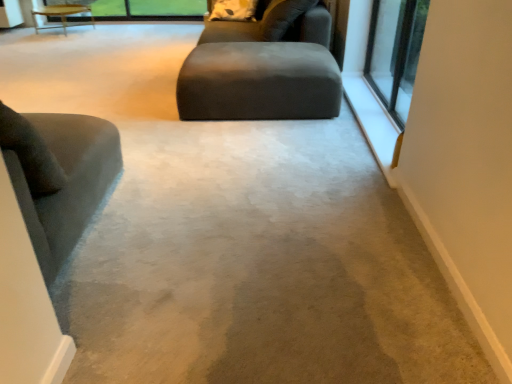
At what (x,y) coordinates should I click in order to perform the action: click on velvet gray chair at left. Please return your answer as a coordinate pair (x, y). Looking at the image, I should click on pos(58,176).

The width and height of the screenshot is (512, 384). Describe the element at coordinates (62, 15) in the screenshot. I see `wooden table at upper left` at that location.

Where is `wooden table at upper left`? This screenshot has width=512, height=384. wooden table at upper left is located at coordinates (62, 15).

What do you see at coordinates (261, 73) in the screenshot? Image resolution: width=512 pixels, height=384 pixels. I see `matte gray ottoman at center` at bounding box center [261, 73].

I want to click on white soft pillow at upper center, so click(x=233, y=10).

Which of these two, velvet gray chair at left or matte gray ottoman at center, is thinner?

velvet gray chair at left.

Between velvet gray chair at left and matte gray ottoman at center, which one is positioned in front?

velvet gray chair at left.

Considering the relative sizes of velvet gray chair at left and matte gray ottoman at center in the image provided, is velvet gray chair at left bigger than matte gray ottoman at center?

Indeed, velvet gray chair at left has a larger size compared to matte gray ottoman at center.

What's the angular difference between velvet gray chair at left and matte gray ottoman at center's facing directions?

92.4 degrees.

Is wooden table at upper left at the back of clear glass window at upper right?

No, clear glass window at upper right is not facing away from wooden table at upper left.

Are clear glass window at upper right and wooden table at upper left beside each other?

No, clear glass window at upper right is not in contact with wooden table at upper left.

From a real-world perspective, between clear glass window at upper right and wooden table at upper left, who is vertically lower?

wooden table at upper left is physically lower.

The height and width of the screenshot is (384, 512). What are the coordinates of `table below the clear glass window at upper right (from a real-world perspective)` in the screenshot? It's located at (62, 15).

In the scene shown: From the image's perspective, is clear glass window at upper right beneath matte gray ottoman at center?

Actually, clear glass window at upper right appears above matte gray ottoman at center in the image.

Looking at the image, does clear glass window at upper right seem bigger or smaller compared to matte gray ottoman at center?

In the image, clear glass window at upper right appears to be smaller than matte gray ottoman at center.

What's the angular difference between clear glass window at upper right and matte gray ottoman at center's facing directions?

There is a 1.36-degree angle between the facing directions of clear glass window at upper right and matte gray ottoman at center.

Is velvet gray chair at left positioned behind white soft pillow at upper center?

No, the depth of velvet gray chair at left is less than that of white soft pillow at upper center.

What's the angular difference between velvet gray chair at left and white soft pillow at upper center's facing directions?

The facing directions of velvet gray chair at left and white soft pillow at upper center are 177 degrees apart.

Is white soft pillow at upper center a part of velvet gray chair at left?

Definitely not — white soft pillow at upper center is not inside velvet gray chair at left.

Identify the location of table to the left of white soft pillow at upper center. (62, 15).

Is white soft pillow at upper center oriented towards wooden table at upper left?

No, white soft pillow at upper center is not turned towards wooden table at upper left.

From a real-world perspective, which object rests below the other?

wooden table at upper left is physically lower.

Would you consider white soft pillow at upper center to be distant from wooden table at upper left?

Indeed, white soft pillow at upper center is not near wooden table at upper left.

Is the position of wooden table at upper left more distant than that of white soft pillow at upper center?

Yes, wooden table at upper left is further from the viewer.

Consider the image. Which of these two, wooden table at upper left or white soft pillow at upper center, is thinner?

white soft pillow at upper center.

How different are the orientations of wooden table at upper left and white soft pillow at upper center in degrees?

The angle between the facing direction of wooden table at upper left and the facing direction of white soft pillow at upper center is 1.76 degrees.

Who is smaller, wooden table at upper left or white soft pillow at upper center?

With smaller size is white soft pillow at upper center.

Locate an element on the screen. The height and width of the screenshot is (384, 512). studio couch that is on the right side of white soft pillow at upper center is located at coordinates click(x=261, y=73).

From a real-world perspective, relative to white soft pillow at upper center, is matte gray ottoman at center vertically above or below?

From a real-world perspective, matte gray ottoman at center is physically below white soft pillow at upper center.

Is point (223, 63) closer or farther from the camera than point (225, 15)?

Point (223, 63) appears to be closer to the viewer than point (225, 15).

Which object is further away from the camera taking this photo, matte gray ottoman at center or white soft pillow at upper center?

white soft pillow at upper center is further from the camera.

At what (x,y) coordinates should I click in order to perform the action: click on studio couch lying behind the velvet gray chair at left. Please return your answer as a coordinate pair (x, y). This screenshot has width=512, height=384. Looking at the image, I should click on (261, 73).

Locate an element on the screen. window below the wooden table at upper left (from the image's perspective) is located at coordinates (395, 52).

Based on their spatial positions, is matte gray ottoman at center or wooden table at upper left closer to white soft pillow at upper center?

matte gray ottoman at center.

Which object lies further to the anchor point velvet gray chair at left, white soft pillow at upper center or matte gray ottoman at center?

white soft pillow at upper center lies further to velvet gray chair at left than the other object.

Based on their spatial positions, is velvet gray chair at left or wooden table at upper left closer to white soft pillow at upper center?

Among the two, velvet gray chair at left is located nearer to white soft pillow at upper center.

Estimate the real-world distances between objects in this image. Which object is closer to white soft pillow at upper center, wooden table at upper left or clear glass window at upper right?

The object closer to white soft pillow at upper center is clear glass window at upper right.

When comparing their distances from white soft pillow at upper center, does velvet gray chair at left or matte gray ottoman at center seem closer?

Based on the image, matte gray ottoman at center appears to be nearer to white soft pillow at upper center.

When comparing their distances from velvet gray chair at left, does clear glass window at upper right or matte gray ottoman at center seem closer?

matte gray ottoman at center lies closer to velvet gray chair at left than the other object.

Considering their positions, is white soft pillow at upper center positioned closer to clear glass window at upper right than velvet gray chair at left?

The object closer to clear glass window at upper right is white soft pillow at upper center.

Considering their positions, is velvet gray chair at left positioned closer to clear glass window at upper right than matte gray ottoman at center?

matte gray ottoman at center is positioned closer to the anchor clear glass window at upper right.

This screenshot has height=384, width=512. I want to click on studio couch between wooden table at upper left and clear glass window at upper right in the horizontal direction, so coord(261,73).

You are a GUI agent. You are given a task and a screenshot of the screen. Output one action in this format:
    pyautogui.click(x=<x>, y=<y>)
    Task: Click on the pillow between wooden table at upper left and clear glass window at upper right
    
    Given the screenshot: What is the action you would take?
    pyautogui.click(x=233, y=10)

You are a GUI agent. You are given a task and a screenshot of the screen. Output one action in this format:
    pyautogui.click(x=<x>, y=<y>)
    Task: Click on the window between velvet gray chair at left and wooden table at upper left from front to back
    This screenshot has width=512, height=384.
    Given the screenshot: What is the action you would take?
    pyautogui.click(x=395, y=52)

Find the location of a particular element. The image size is (512, 384). pillow between velvet gray chair at left and wooden table at upper left along the z-axis is located at coordinates (233, 10).